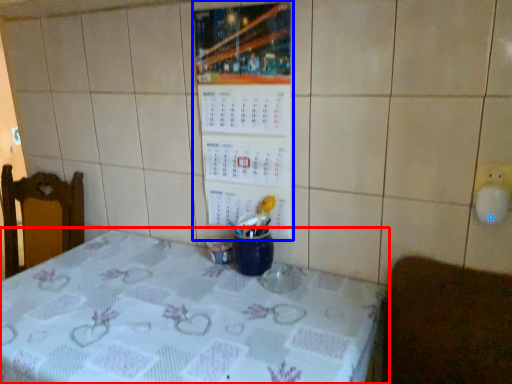
Question: Which object appears closest to the camera in this image, table (highlighted by a red box) or bulletin board (highlighted by a blue box)?

Choices:
 (A) table
 (B) bulletin board

Answer: (A)